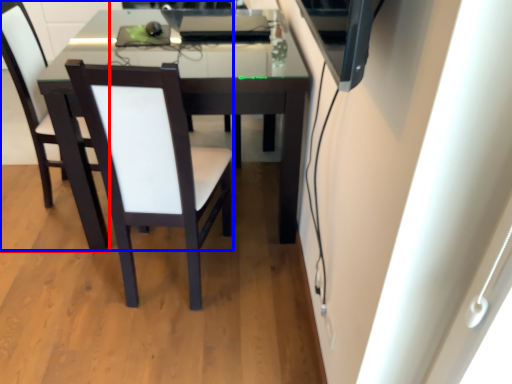
Question: Which object is closer to the camera taking this photo, chair (highlighted by a red box) or chair (highlighted by a blue box)?

Choices:
 (A) chair
 (B) chair

Answer: (B)